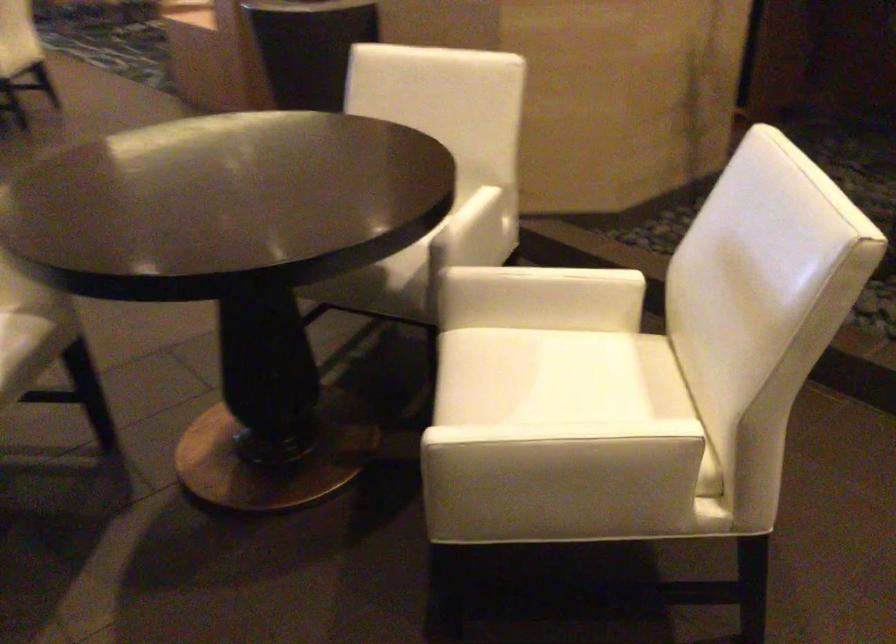
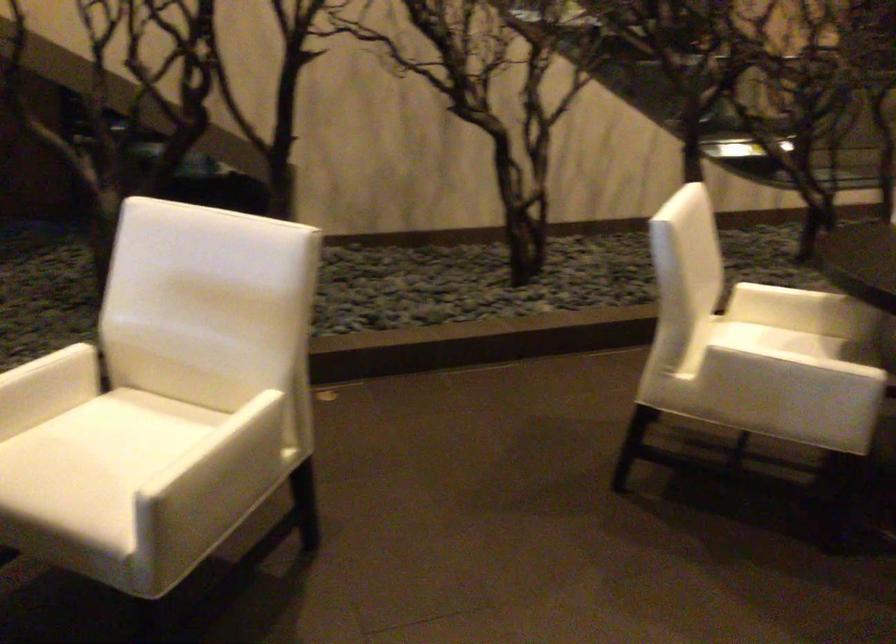
Where in the second image is the point corresponding to (540,391) from the first image?

(105, 458)